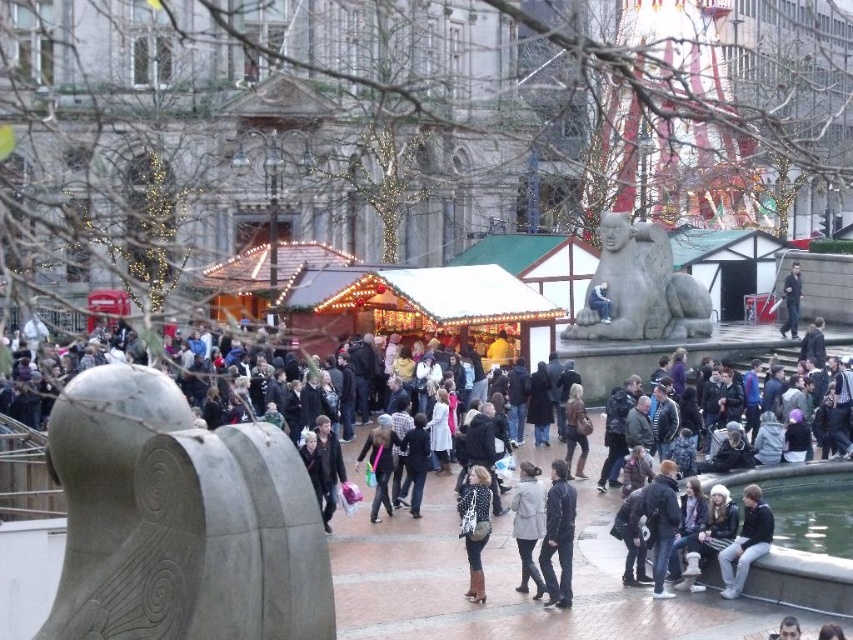
You are standing at the point labeled as point (784, 296) and want to walk towards the point labeled as point (378, 480). Which direction should you move relative to your current position?

You should move forward because point (378, 480) is in front of point (784, 296).

You are standing at the center of the square and see the point marked at coordinates (180, 520). What object is located at that point?

The gray stone sculpture at center is located at the point marked at coordinates (180, 520).